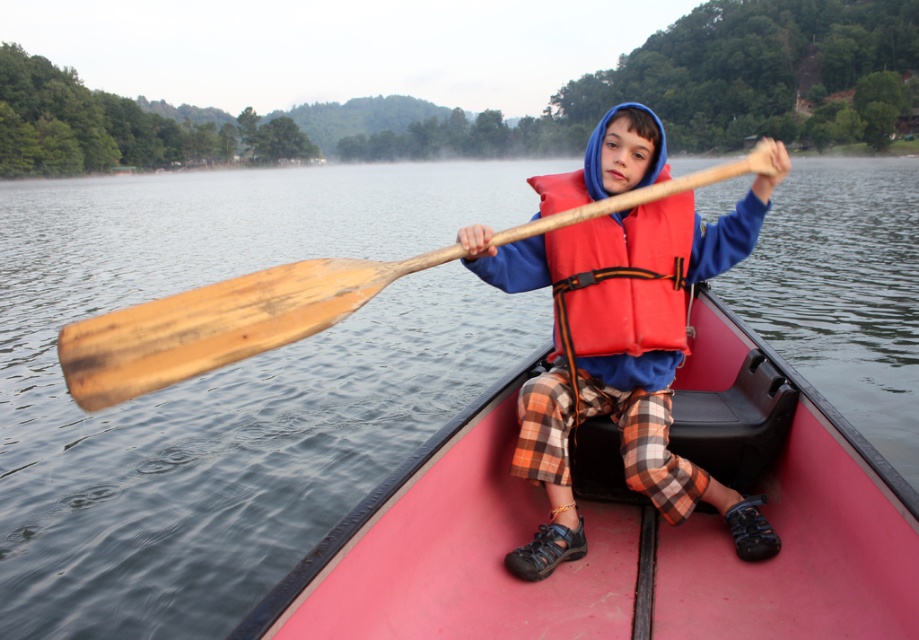
You are standing on the shore and looking at the red canoe with two points marked on it. Which point is closer to you, point (660, 502) or point (252, 310)?

Point (252, 310) is closer to you because it is less further to the viewer than point (660, 502).